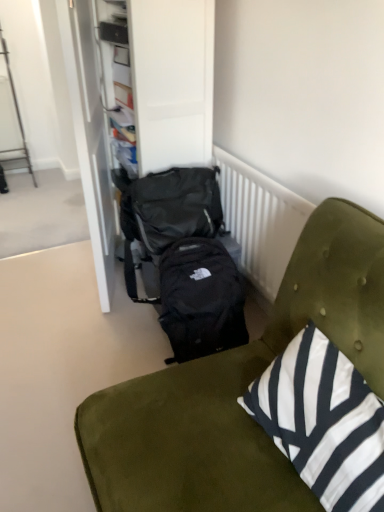
This screenshot has width=384, height=512. In order to click on vacant area situated to the left side of black matte backpack at center, which is counted as the second backpack, starting from the top in this screenshot , I will do `click(123, 346)`.